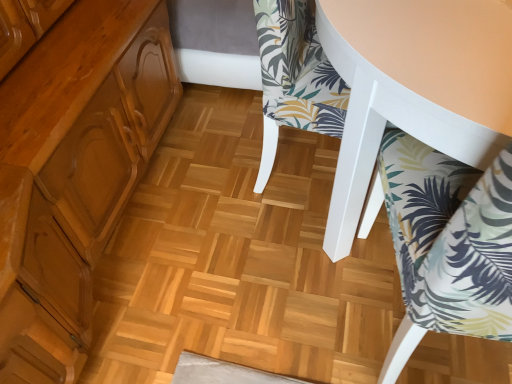
Question: Can you confirm if white fabric chair at upper right, which is counted as the second chair, starting from the bottom, is thinner than printed fabric chair at lower right, which ranks as the 1th chair in bottom-to-top order?

Choices:
 (A) yes
 (B) no

Answer: (B)

Question: Is white fabric chair at upper right, the 1th chair viewed from the top, oriented away from printed fabric chair at lower right, which ranks as the 1th chair in bottom-to-top order?

Choices:
 (A) yes
 (B) no

Answer: (B)

Question: From the image's perspective, is white fabric chair at upper right, the 1th chair viewed from the top, above printed fabric chair at lower right, which ranks as the 1th chair in bottom-to-top order?

Choices:
 (A) no
 (B) yes

Answer: (B)

Question: From a real-world perspective, is white fabric chair at upper right, the 1th chair viewed from the top, under printed fabric chair at lower right, which appears as the 2th chair when viewed from the top?

Choices:
 (A) yes
 (B) no

Answer: (A)

Question: Does white fabric chair at upper right, which is counted as the second chair, starting from the bottom, have a greater height compared to printed fabric chair at lower right, which appears as the 2th chair when viewed from the top?

Choices:
 (A) no
 (B) yes

Answer: (A)

Question: Does white fabric chair at upper right, which is counted as the second chair, starting from the bottom, have a lesser height compared to printed fabric chair at lower right, which ranks as the 1th chair in bottom-to-top order?

Choices:
 (A) yes
 (B) no

Answer: (A)

Question: Does printed fabric chair at lower right, which ranks as the 1th chair in bottom-to-top order, have a larger size compared to white fabric chair at upper right, the 1th chair viewed from the top?

Choices:
 (A) yes
 (B) no

Answer: (B)

Question: Is printed fabric chair at lower right, which ranks as the 1th chair in bottom-to-top order, to the left of white fabric chair at upper right, the 1th chair viewed from the top, from the viewer's perspective?

Choices:
 (A) no
 (B) yes

Answer: (A)

Question: Can you confirm if printed fabric chair at lower right, which ranks as the 1th chair in bottom-to-top order, is thinner than white fabric chair at upper right, which is counted as the second chair, starting from the bottom?

Choices:
 (A) yes
 (B) no

Answer: (A)

Question: From a real-world perspective, is printed fabric chair at lower right, which appears as the 2th chair when viewed from the top, below white fabric chair at upper right, which is counted as the second chair, starting from the bottom?

Choices:
 (A) yes
 (B) no

Answer: (B)

Question: Can you confirm if printed fabric chair at lower right, which ranks as the 1th chair in bottom-to-top order, is wider than white fabric chair at upper right, which is counted as the second chair, starting from the bottom?

Choices:
 (A) no
 (B) yes

Answer: (A)

Question: Does printed fabric chair at lower right, which ranks as the 1th chair in bottom-to-top order, lie behind white fabric chair at upper right, the 1th chair viewed from the top?

Choices:
 (A) yes
 (B) no

Answer: (B)

Question: Relative to printed fabric chair at lower right, which ranks as the 1th chair in bottom-to-top order, is white fabric chair at upper right, which is counted as the second chair, starting from the bottom, in front or behind?

Choices:
 (A) front
 (B) behind

Answer: (B)